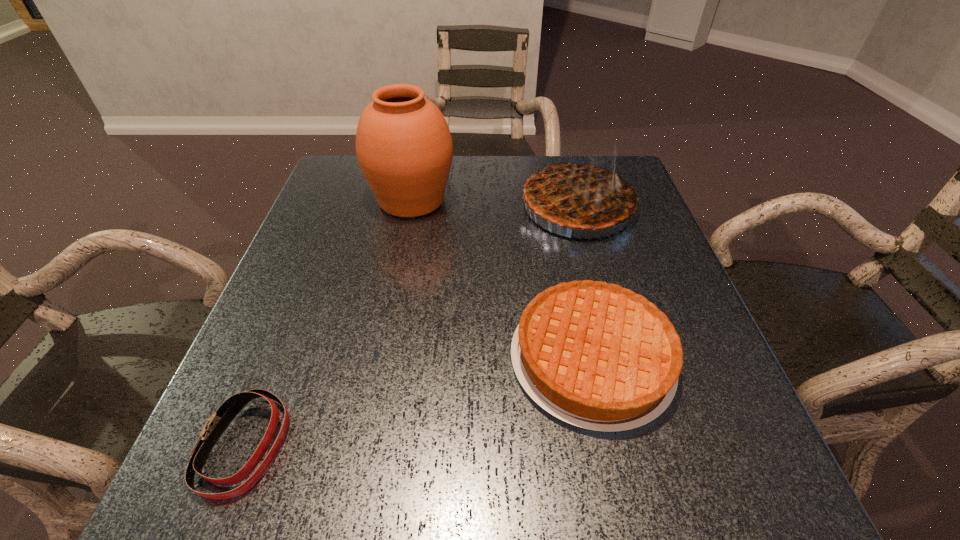
Locate an element on the screen. free space located on the back of the shorter pie is located at coordinates (572, 273).

This screenshot has width=960, height=540. What are the coordinates of `free space located on the back of the dog collar` in the screenshot? It's located at (303, 296).

Where is `urn that is at the far edge`? The height and width of the screenshot is (540, 960). urn that is at the far edge is located at coordinates (404, 148).

This screenshot has width=960, height=540. In order to click on pie that is positioned at the far edge in this screenshot , I will do `click(577, 194)`.

Find the location of a particular element. This screenshot has width=960, height=540. object located in the near edge section of the desktop is located at coordinates (218, 422).

Where is `urn that is positioned at the left edge`? This screenshot has height=540, width=960. urn that is positioned at the left edge is located at coordinates (404, 148).

The width and height of the screenshot is (960, 540). Identify the location of dog collar located in the left edge section of the desktop. (218, 422).

The width and height of the screenshot is (960, 540). Find the location of `object that is at the far left corner`. object that is at the far left corner is located at coordinates (404, 148).

Locate an element on the screen. The width and height of the screenshot is (960, 540). object that is at the near left corner is located at coordinates [x=218, y=422].

You are a GUI agent. You are given a task and a screenshot of the screen. Output one action in this format:
    pyautogui.click(x=<x>, y=<y>)
    Task: Click on the object at the far right corner
    
    Given the screenshot: What is the action you would take?
    pyautogui.click(x=577, y=194)